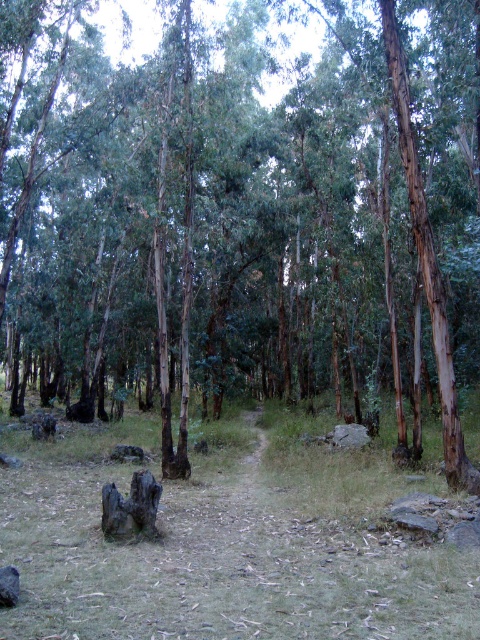
Question: Is green grass at center above gray rough rock at center?

Choices:
 (A) yes
 (B) no

Answer: (A)

Question: Estimate the real-world distances between objects in this image. Which object is closer to the charred wood stump at center?

Choices:
 (A) gray rough rock at center
 (B) green grass at center

Answer: (B)

Question: Which point appears farthest from the camera in this image?

Choices:
 (A) (111, 534)
 (B) (352, 432)

Answer: (B)

Question: Does charred wood stump at center appear under gray rough rock at center?

Choices:
 (A) yes
 (B) no

Answer: (B)

Question: Is charred wood stump at center wider than gray rough rock at center?

Choices:
 (A) yes
 (B) no

Answer: (B)

Question: Among these objects, which one is nearest to the camera?

Choices:
 (A) gray rough rock at center
 (B) green grass at center
 (C) charred wood stump at center

Answer: (B)